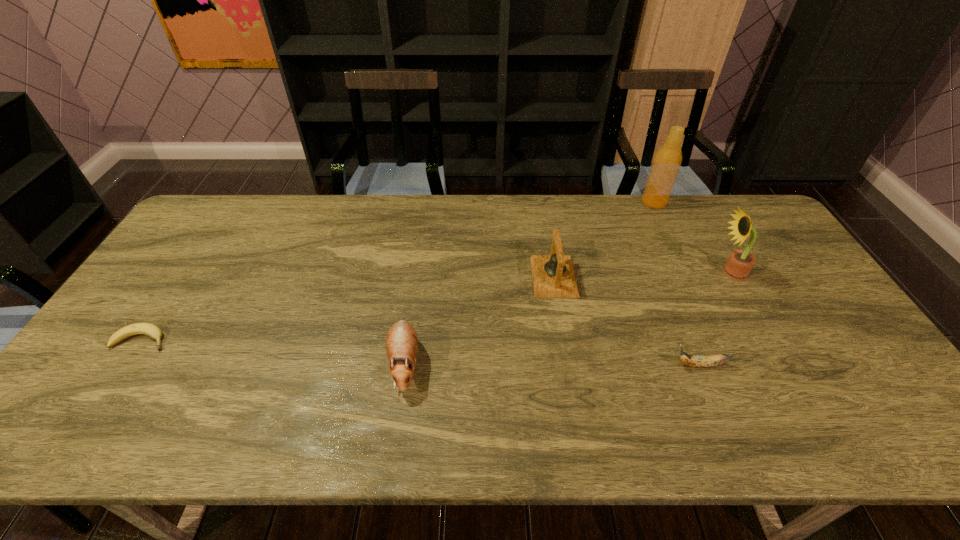
Find the location of a particular element. the tallest object is located at coordinates (666, 163).

Where is `the farthest object`? the farthest object is located at coordinates (666, 163).

Locate an element on the screen. This screenshot has width=960, height=540. the rightmost object is located at coordinates (739, 264).

Find the location of a particular element. sunflower is located at coordinates (739, 264).

The height and width of the screenshot is (540, 960). I want to click on bell, so click(553, 275).

Locate an element on the screen. the second object from left to right is located at coordinates (401, 342).

What are the coordinates of `the nearer banana` in the screenshot? It's located at (698, 361).

Locate an element on the screen. The height and width of the screenshot is (540, 960). the taller banana is located at coordinates (698, 361).

Locate an element on the screen. the farther banana is located at coordinates (151, 330).

Image resolution: width=960 pixels, height=540 pixels. I want to click on the leftmost object, so click(x=151, y=330).